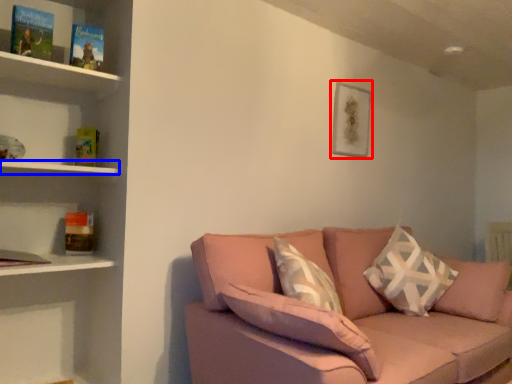
Question: Among these objects, which one is farthest to the camera, picture frame (highlighted by a red box) or shelf (highlighted by a blue box)?

Choices:
 (A) picture frame
 (B) shelf

Answer: (A)